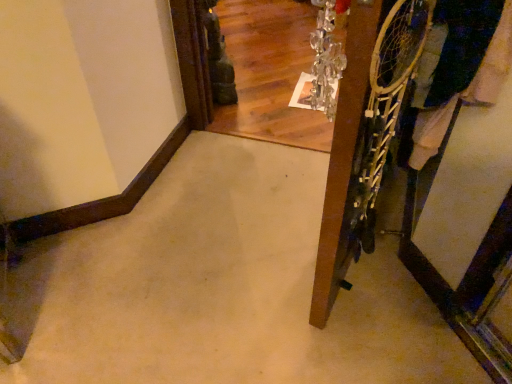
Question: Is dark blue fabric at right wider than wooden door at right?

Choices:
 (A) yes
 (B) no

Answer: (A)

Question: Does dark blue fabric at right have a smaller size compared to wooden door at right?

Choices:
 (A) yes
 (B) no

Answer: (B)

Question: Is dark blue fabric at right positioned behind wooden door at right?

Choices:
 (A) yes
 (B) no

Answer: (A)

Question: From a real-world perspective, is dark blue fabric at right beneath wooden door at right?

Choices:
 (A) no
 (B) yes

Answer: (B)

Question: From the image's perspective, would you say dark blue fabric at right is shown under wooden door at right?

Choices:
 (A) yes
 (B) no

Answer: (B)

Question: Is dark blue fabric at right not inside wooden door at right?

Choices:
 (A) yes
 (B) no

Answer: (A)

Question: Is wooden door at right to the left of dark blue fabric at right from the viewer's perspective?

Choices:
 (A) no
 (B) yes

Answer: (B)

Question: Considering the relative sizes of wooden door at right and dark blue fabric at right in the image provided, is wooden door at right smaller than dark blue fabric at right?

Choices:
 (A) no
 (B) yes

Answer: (B)

Question: Could you tell me if wooden door at right is turned towards dark blue fabric at right?

Choices:
 (A) no
 (B) yes

Answer: (A)

Question: From the image's perspective, does wooden door at right appear higher than dark blue fabric at right?

Choices:
 (A) yes
 (B) no

Answer: (B)

Question: Is wooden door at right positioned beyond the bounds of dark blue fabric at right?

Choices:
 (A) yes
 (B) no

Answer: (A)

Question: Does wooden door at right have a greater height compared to dark blue fabric at right?

Choices:
 (A) no
 (B) yes

Answer: (B)

Question: From a real-world perspective, is wooden door at right positioned above or below dark blue fabric at right?

Choices:
 (A) above
 (B) below

Answer: (A)